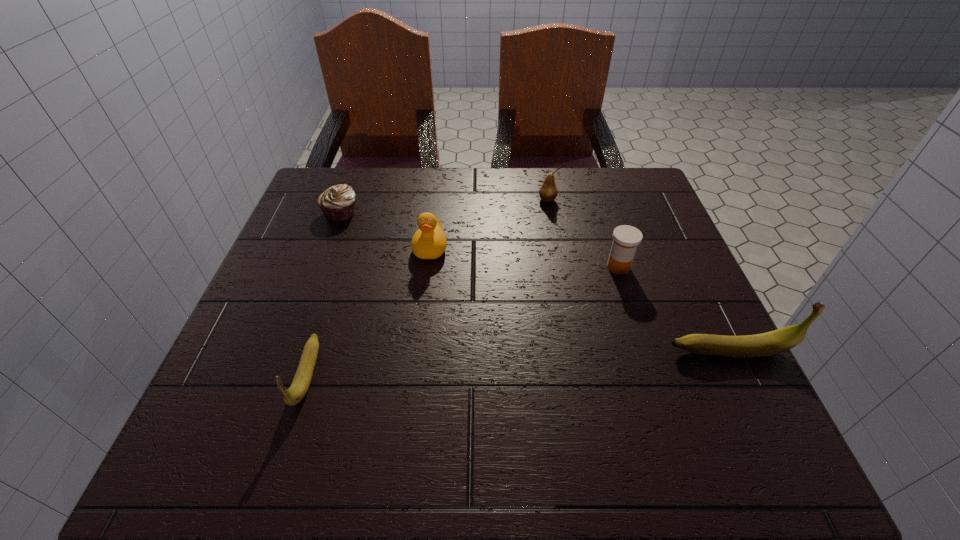
I want to click on vacant space that satisfies the following two spatial constraints: 1. at the stem of the rightmost object; 2. at the stem of the shorter banana, so click(x=740, y=375).